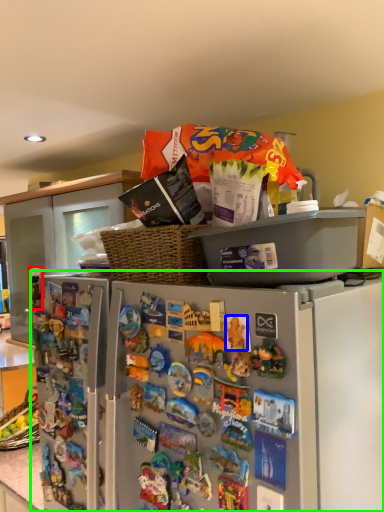
Question: Considering the real-world distances, which object is closest to toy (highlighted by a red box)? toy (highlighted by a blue box) or refrigerator (highlighted by a green box).

Choices:
 (A) toy
 (B) refrigerator

Answer: (B)